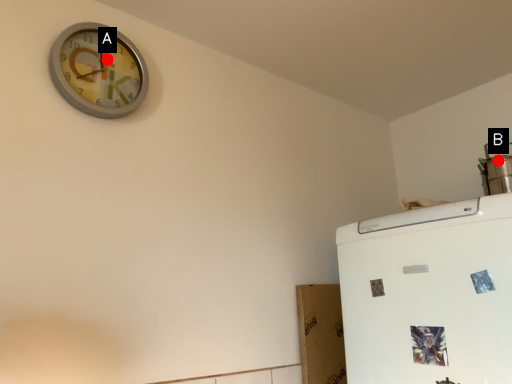
Question: Two points are circled on the image, labeled by A and B beside each circle. Which point is closer to the camera taking this photo?

Choices:
 (A) A is closer
 (B) B is closer

Answer: (A)